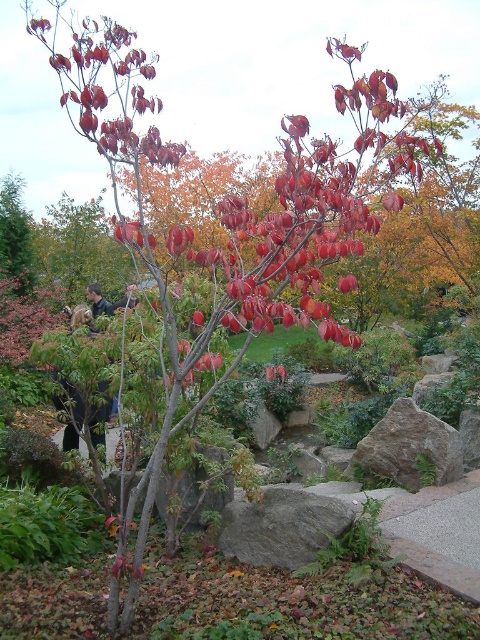
Question: In this image, where is gray rough rock at lower right located relative to green matte tree at left?

Choices:
 (A) left
 (B) right

Answer: (B)

Question: Is gray rough rock at center positioned in front of gray rough rock at lower right?

Choices:
 (A) no
 (B) yes

Answer: (B)

Question: Which object appears farthest from the camera in this image?

Choices:
 (A) gray rough rock at center
 (B) gray rough rock at lower right
 (C) green matte tree at left

Answer: (C)

Question: Which point is closer to the camera taking this photo?

Choices:
 (A) (241, 534)
 (B) (454, 461)
 (C) (12, 266)

Answer: (A)

Question: Is gray rough rock at center to the left of gray rough rock at lower right from the viewer's perspective?

Choices:
 (A) yes
 (B) no

Answer: (A)

Question: Which point is closer to the camera?

Choices:
 (A) (x=13, y=180)
 (B) (x=409, y=401)

Answer: (B)